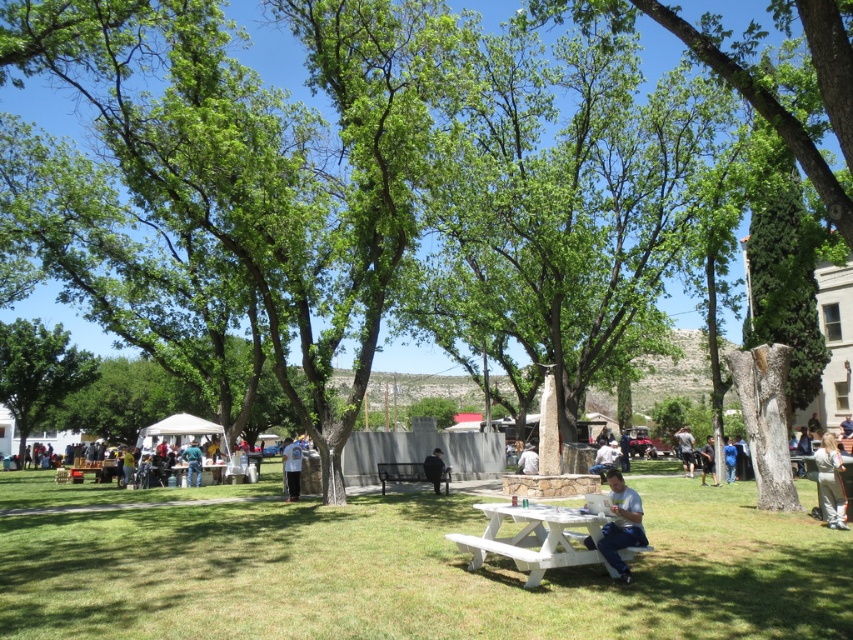
Question: Which of these objects is positioned closest to the dark blue fabric jacket at center?

Choices:
 (A) metallic black bench at center
 (B) black fabric bag at lower right
 (C) light brown suede jacket at lower right
 (D) gray fabric shirt at lower right

Answer: (A)

Question: Observing the image, what is the correct spatial positioning of green grass at lower center in reference to white plastic picnic table at center?

Choices:
 (A) right
 (B) left

Answer: (B)

Question: Is green leafy tree at left positioned in front of white plastic picnic table at center?

Choices:
 (A) no
 (B) yes

Answer: (A)

Question: Estimate the real-world distances between objects in this image. Which object is farther from the green grass at lower center?

Choices:
 (A) gray fabric shirt at lower right
 (B) light blue t-shirt at lower right
 (C) white fabric bag at center

Answer: (A)

Question: Is metallic black bench at center positioned before gray fabric shirt at lower right?

Choices:
 (A) no
 (B) yes

Answer: (B)

Question: Which of the following is the farthest from the observer?

Choices:
 (A) (630, 488)
 (B) (711, 438)
 (C) (840, 500)
 (D) (520, 461)

Answer: (B)